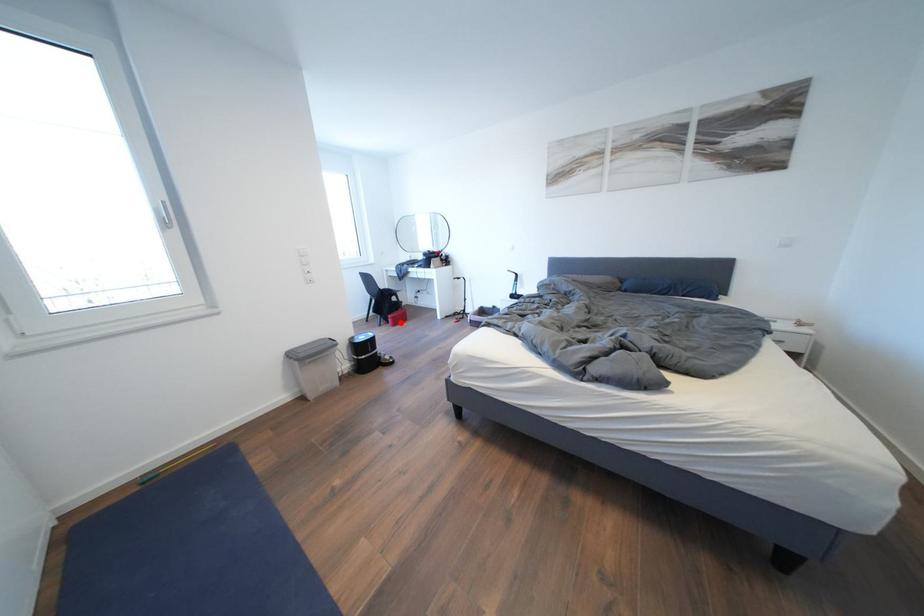
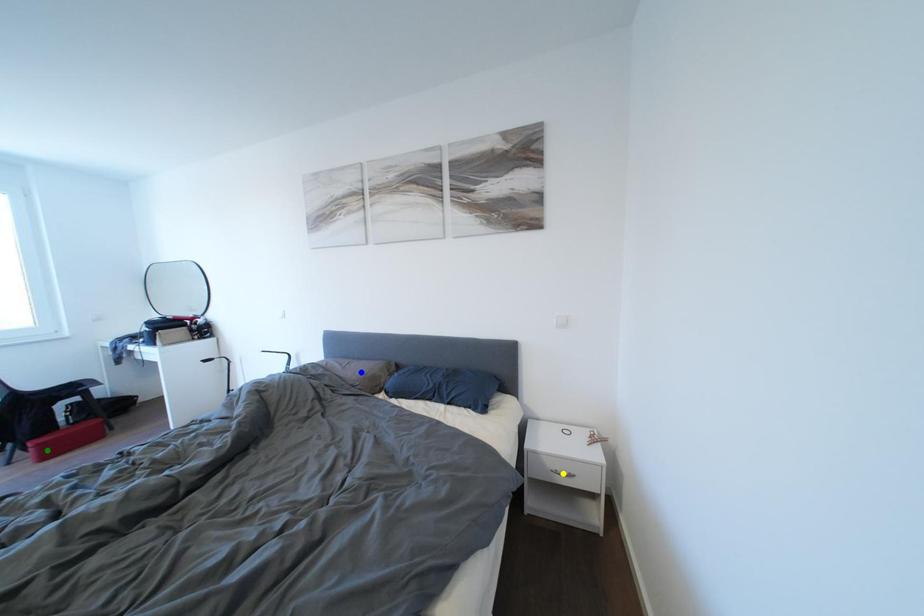
Question: I am providing you with two images of the same scene from different viewpoints. A red point is marked on the first image. You are given multiple points on the second image. Which mark in image 2 goes with the point in image 1?

Choices:
 (A) green point
 (B) yellow point
 (C) blue point

Answer: (A)